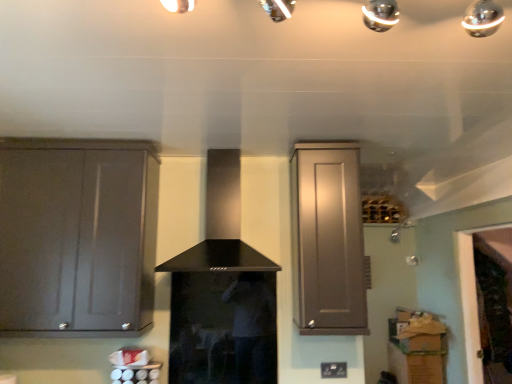
Describe the element at coordinates (77, 236) in the screenshot. I see `matte gray cabinet at left, the second cabinetry positioned from the right` at that location.

Measure the distance between point (x=172, y=259) and camera.

The depth of point (x=172, y=259) is 2.46 meters.

Describe the element at coordinates (203, 215) in the screenshot. I see `black matte vent at center` at that location.

What do you see at coordinates (327, 239) in the screenshot? I see `matte gray cabinet at upper right, the first cabinetry positioned from the right` at bounding box center [327, 239].

Identify the location of matte gray cabinet at left, the second cabinetry positioned from the right. click(77, 236).

Measure the distance between matte gray cabinet at left, the first cabinetry from the left, and black matte vent at center.

A distance of 19.09 inches exists between matte gray cabinet at left, the first cabinetry from the left, and black matte vent at center.

Is matte gray cabinet at left, the second cabinetry positioned from the right, positioned beyond the bounds of black matte vent at center?

Yes, matte gray cabinet at left, the second cabinetry positioned from the right, is not within black matte vent at center.

From a real-world perspective, who is located lower, matte gray cabinet at left, the first cabinetry from the left, or black matte vent at center?

matte gray cabinet at left, the first cabinetry from the left, is physically lower.

Is matte gray cabinet at left, the second cabinetry positioned from the right, touching black matte vent at center?

There is a gap between matte gray cabinet at left, the second cabinetry positioned from the right, and black matte vent at center.

Based on the photo, does black matte vent at center have a larger size compared to matte gray cabinet at upper right, the first cabinetry positioned from the right?

Yes, black matte vent at center is bigger than matte gray cabinet at upper right, the first cabinetry positioned from the right.

Looking at this image, from the image's perspective, is black matte vent at center on matte gray cabinet at upper right, the first cabinetry positioned from the right?

Yes, from the image's perspective, black matte vent at center is on top of matte gray cabinet at upper right, the first cabinetry positioned from the right.

Is black matte vent at center positioned with its back to matte gray cabinet at upper right, the first cabinetry positioned from the right?

No, black matte vent at center is not facing the opposite direction of matte gray cabinet at upper right, the first cabinetry positioned from the right.

Is black matte vent at center further to camera compared to matte gray cabinet at left, the second cabinetry positioned from the right?

No, it is not.

From a real-world perspective, is black matte vent at center positioned above or below matte gray cabinet at left, the second cabinetry positioned from the right?

From a real-world perspective, black matte vent at center is physically above matte gray cabinet at left, the second cabinetry positioned from the right.

Is black matte vent at center oriented towards matte gray cabinet at left, the second cabinetry positioned from the right?

No, black matte vent at center does not turn towards matte gray cabinet at left, the second cabinetry positioned from the right.

Could you tell me if matte gray cabinet at upper right, the first cabinetry positioned from the right, is facing matte gray cabinet at left, the second cabinetry positioned from the right?

No.

From a real-world perspective, which object stands above the other?

matte gray cabinet at upper right, the 2th cabinetry when ordered from left to right.

Considering the sizes of objects matte gray cabinet at upper right, the first cabinetry positioned from the right, and matte gray cabinet at left, the first cabinetry from the left, in the image provided, who is shorter, matte gray cabinet at upper right, the first cabinetry positioned from the right, or matte gray cabinet at left, the first cabinetry from the left,?

matte gray cabinet at left, the first cabinetry from the left.

Are matte gray cabinet at upper right, the first cabinetry positioned from the right, and matte gray cabinet at left, the first cabinetry from the left, making contact?

matte gray cabinet at upper right, the first cabinetry positioned from the right, is not next to matte gray cabinet at left, the first cabinetry from the left, and they're not touching.

Is matte gray cabinet at left, the second cabinetry positioned from the right, not inside matte gray cabinet at upper right, the 2th cabinetry when ordered from left to right?

Yes, matte gray cabinet at left, the second cabinetry positioned from the right, is not within matte gray cabinet at upper right, the 2th cabinetry when ordered from left to right.

Locate an element on the screen. This screenshot has width=512, height=384. cabinetry in front of the matte gray cabinet at upper right, the 2th cabinetry when ordered from left to right is located at coordinates (77, 236).

Between matte gray cabinet at upper right, the 2th cabinetry when ordered from left to right, and black matte vent at center, which one has more height?

With more height is matte gray cabinet at upper right, the 2th cabinetry when ordered from left to right.

From the picture: Can you confirm if matte gray cabinet at upper right, the first cabinetry positioned from the right, is wider than black matte vent at center?

In fact, matte gray cabinet at upper right, the first cabinetry positioned from the right, might be narrower than black matte vent at center.

From the image's perspective, is matte gray cabinet at upper right, the first cabinetry positioned from the right, located beneath black matte vent at center?

Yes.

This screenshot has height=384, width=512. In order to click on vent above the matte gray cabinet at left, the second cabinetry positioned from the right (from a real-world perspective) in this screenshot , I will do `click(203, 215)`.

Identify the location of vent lying above the matte gray cabinet at upper right, the first cabinetry positioned from the right (from the image's perspective). This screenshot has width=512, height=384. (203, 215).

Estimate the real-world distances between objects in this image. Which object is further from matte gray cabinet at upper right, the first cabinetry positioned from the right, black matte vent at center or matte gray cabinet at left, the first cabinetry from the left?

Based on the image, matte gray cabinet at left, the first cabinetry from the left, appears to be further to matte gray cabinet at upper right, the first cabinetry positioned from the right.

Considering their positions, is matte gray cabinet at left, the first cabinetry from the left, positioned closer to matte gray cabinet at upper right, the first cabinetry positioned from the right, than black matte vent at center?

The object closer to matte gray cabinet at upper right, the first cabinetry positioned from the right, is black matte vent at center.

When comparing their distances from matte gray cabinet at left, the second cabinetry positioned from the right, does matte gray cabinet at upper right, the first cabinetry positioned from the right, or black matte vent at center seem further?

matte gray cabinet at upper right, the first cabinetry positioned from the right.

Looking at this image, estimate the real-world distances between objects in this image. Which object is further from matte gray cabinet at left, the second cabinetry positioned from the right, black matte vent at center or matte gray cabinet at upper right, the 2th cabinetry when ordered from left to right?

matte gray cabinet at upper right, the 2th cabinetry when ordered from left to right, is positioned further to the anchor matte gray cabinet at left, the second cabinetry positioned from the right.

Considering their positions, is matte gray cabinet at left, the first cabinetry from the left, positioned closer to black matte vent at center than matte gray cabinet at upper right, the first cabinetry positioned from the right?

matte gray cabinet at left, the first cabinetry from the left, is closer to black matte vent at center.

From the image, which object appears to be farther from black matte vent at center, matte gray cabinet at upper right, the first cabinetry positioned from the right, or matte gray cabinet at left, the first cabinetry from the left?

Among the two, matte gray cabinet at upper right, the first cabinetry positioned from the right, is located further to black matte vent at center.

The height and width of the screenshot is (384, 512). I want to click on vent situated between matte gray cabinet at left, the second cabinetry positioned from the right, and matte gray cabinet at upper right, the first cabinetry positioned from the right, from left to right, so click(x=203, y=215).